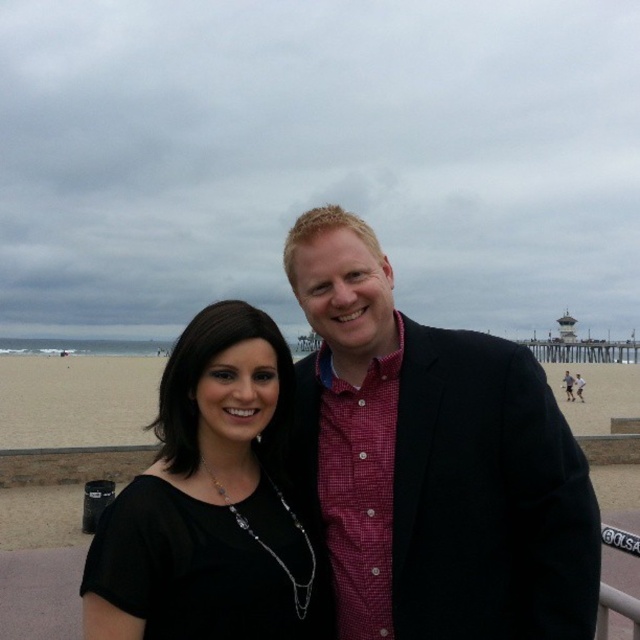
Which is in front, point (321, 449) or point (198, 541)?

Positioned in front is point (198, 541).

Where is `red checkered shirt at center`? red checkered shirt at center is located at coordinates (433, 461).